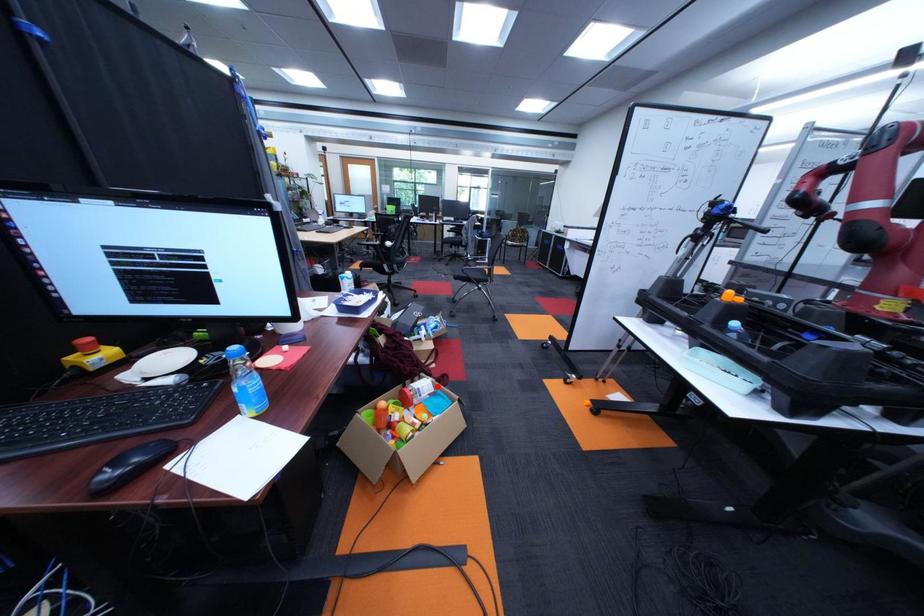
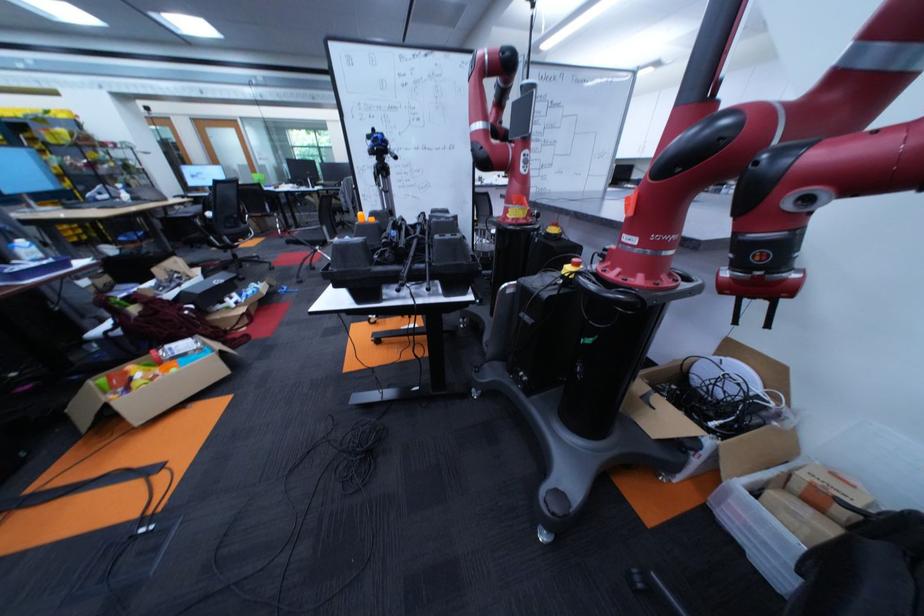
Question: I am providing you with two images of the same scene from different viewpoints. Image1 has a red point marked. In image2, the corresponding 3D location appears at what relative position? Reply with the corresponding letter.

Choices:
 (A) Closer
 (B) Farther

Answer: (B)